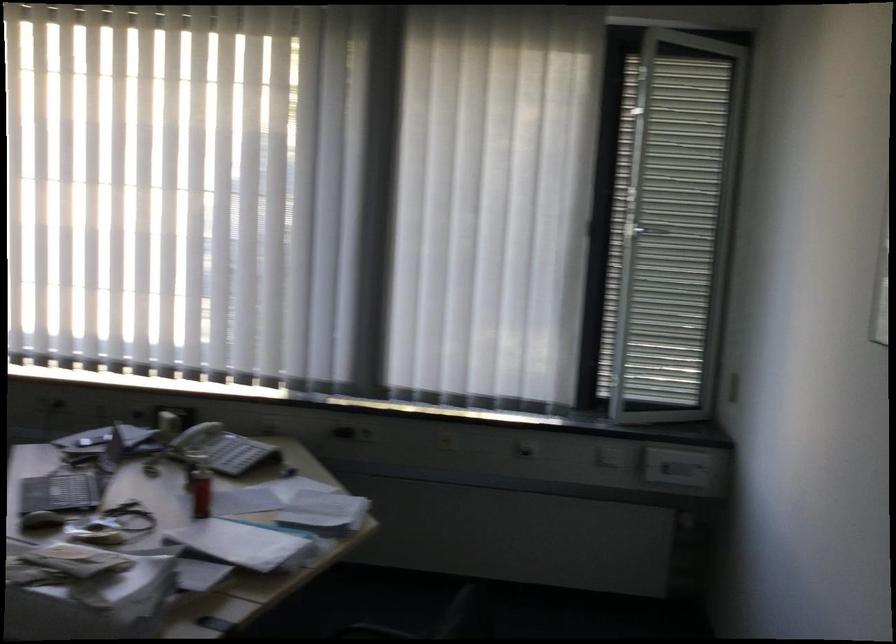
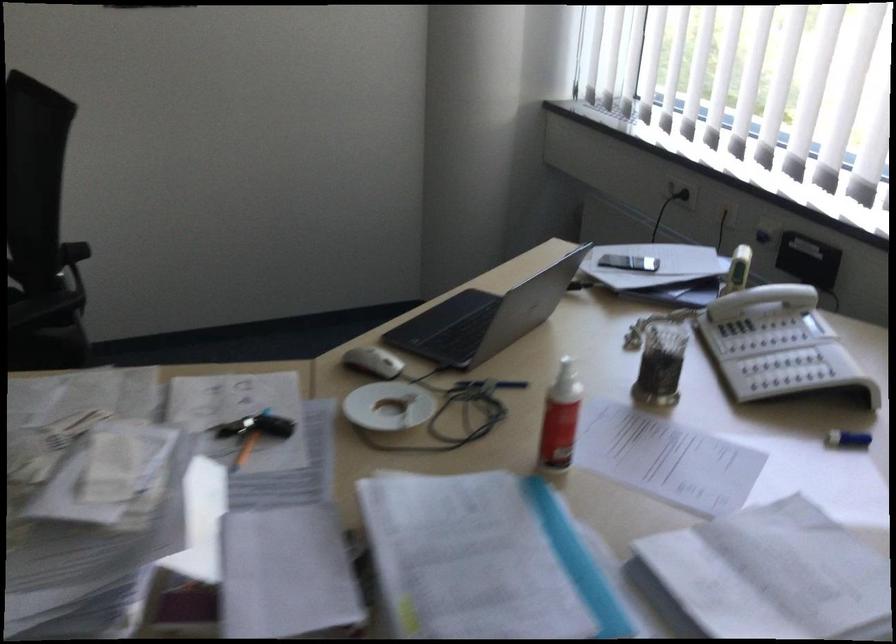
Locate, in the second image, the point that corresponds to pixel 205 460 in the first image.

(567, 375)